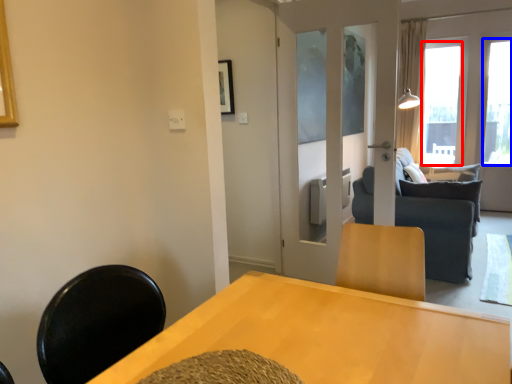
Question: Which object is further to the camera taking this photo, window (highlighted by a red box) or window (highlighted by a blue box)?

Choices:
 (A) window
 (B) window

Answer: (A)